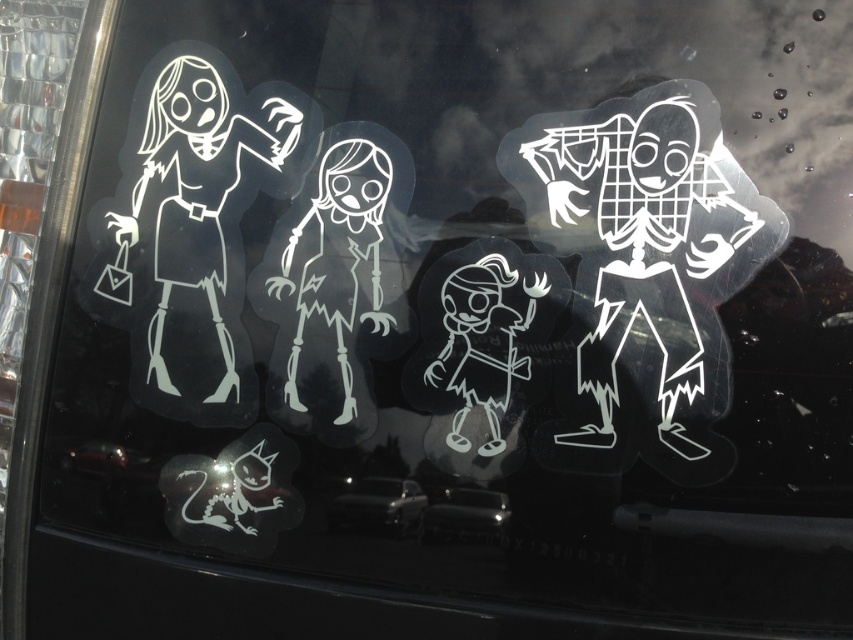
You are a delivery robot with a width of 12 inches. You need to pass between the transparent plastic figure at right and the black glossy car at center. Can you fit through the space between them?

The transparent plastic figure at right and the black glossy car at center are 13.22 inches apart, so yes, the robot can fit through the space since its width of 12 inches is less than the 13.22 inches between them.

You are a passenger in a car and notice the transparent plastic figure at right and the black glossy car at center. Which object is covering the other one?

The transparent plastic figure at right is positioned over the black glossy car at center, so it is covering the black glossy car at center.

You are a delivery robot with a package that is 12 inches wide. You need to pass between the white glossy skeleton at center and the black glossy car at center. Can your package fit through the space between them?

The distance between the white glossy skeleton at center and the black glossy car at center is 11.80 inches. Since your package is 12 inches wide, it cannot fit through the space between them.